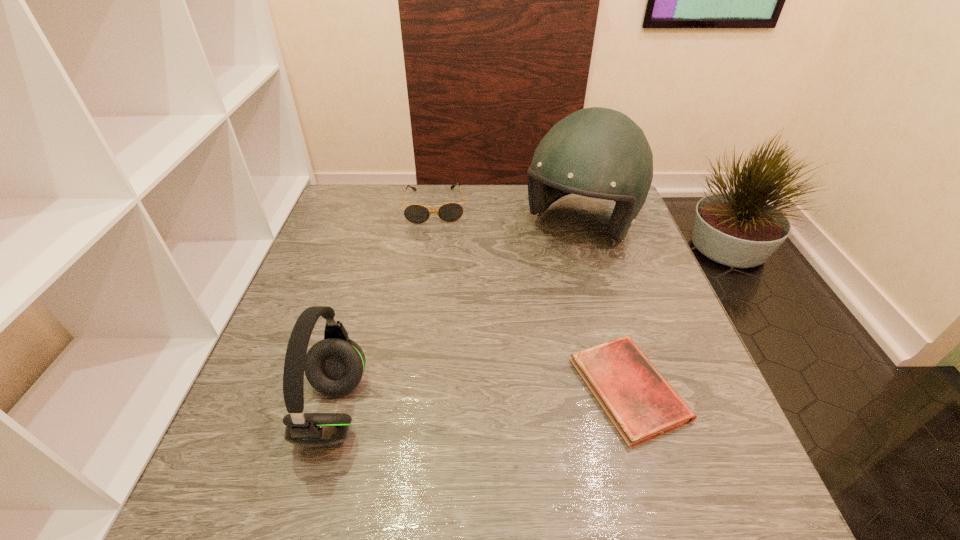
This screenshot has height=540, width=960. What are the coordinates of `vacant space located 0.160m at the face opening of the tallest object` in the screenshot? It's located at (530, 295).

Where is `free space located 0.250m at the face opening of the tallest object`? The width and height of the screenshot is (960, 540). free space located 0.250m at the face opening of the tallest object is located at coordinates (513, 319).

Identify the location of sunglasses that is at the far edge. (449, 212).

Identify the location of football helmet that is at the far edge. (596, 152).

Locate an element on the screen. The height and width of the screenshot is (540, 960). headset present at the near edge is located at coordinates (334, 366).

Locate an element on the screen. The image size is (960, 540). diary located at the near edge is located at coordinates point(641,404).

Identify the location of object that is at the left edge. (334, 366).

Where is `diary positioned at the right edge`? diary positioned at the right edge is located at coordinates (641, 404).

I want to click on football helmet that is at the right edge, so click(596, 152).

The height and width of the screenshot is (540, 960). Identify the location of object at the near left corner. (334, 366).